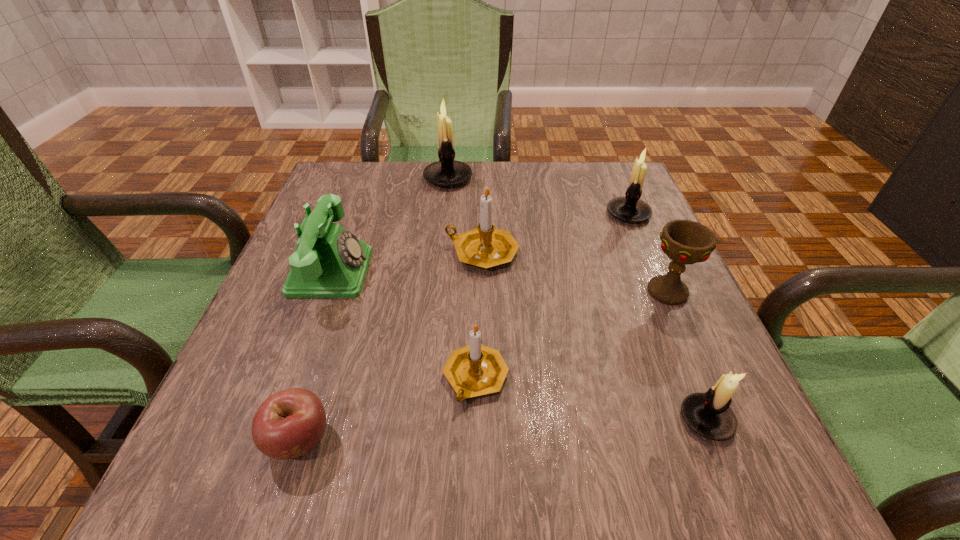
At what (x,y) coordinates should I click in order to perform the action: click on vacant space that's between the smallest white candle holder and the farthest candle holder. Please return your answer as a coordinate pair (x, y). The width and height of the screenshot is (960, 540). Looking at the image, I should click on click(x=577, y=299).

Find the location of a particular element. blank region between the nearer gold candle holder and the chalice is located at coordinates (571, 334).

Locate which object is the third closest to the red chalice. Please provide its 2D coordinates. Your answer should be formatted as a tuple, i.e. [(x, y)], where the tuple contains the x and y coordinates of a point satisfying the conditions above.

[(485, 246)]

Locate which object ranks fifth in proximity to the farther gold candle holder. Please provide its 2D coordinates. Your answer should be formatted as a tuple, i.e. [(x, y)], where the tuple contains the x and y coordinates of a point satisfying the conditions above.

[(684, 241)]

Choose which candle holder is the second nearest neighbor to the leftmost white candle holder. Please provide its 2D coordinates. Your answer should be formatted as a tuple, i.e. [(x, y)], where the tuple contains the x and y coordinates of a point satisfying the conditions above.

[(630, 208)]

You are a GUI agent. You are given a task and a screenshot of the screen. Output one action in this format:
    pyautogui.click(x=<x>, y=<y>)
    Task: Click on the fourth closest candle holder relative to the telephone
    The height and width of the screenshot is (540, 960).
    Given the screenshot: What is the action you would take?
    pyautogui.click(x=630, y=208)

Image resolution: width=960 pixels, height=540 pixels. Identify the location of white candle holder that stands as the second closest to the biggest white candle holder. (708, 414).

Identify the location of white candle holder that stands as the closest to the biggest white candle holder. click(630, 208).

This screenshot has height=540, width=960. Find the location of `vacant space that satisfies the following two spatial constraints: 1. on the front side of the smallest white candle holder; 2. on the right side of the bigger gold candle holder`. vacant space that satisfies the following two spatial constraints: 1. on the front side of the smallest white candle holder; 2. on the right side of the bigger gold candle holder is located at coordinates (483, 419).

At what (x,y) coordinates should I click in order to perform the action: click on blank area in the image that satisfies the following two spatial constraints: 1. on the dial of the telephone; 2. on the right side of the nearer gold candle holder. Please return your answer as a coordinate pair (x, y). Looking at the image, I should click on (292, 378).